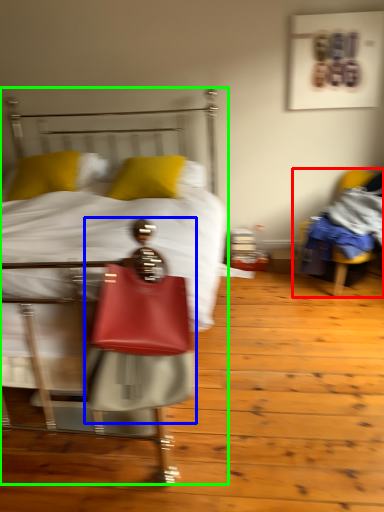
Question: Which object is the closest to the chair (highlighted by a red box)? Choose among these: person (highlighted by a blue box) or bed (highlighted by a green box).

Choices:
 (A) person
 (B) bed

Answer: (B)